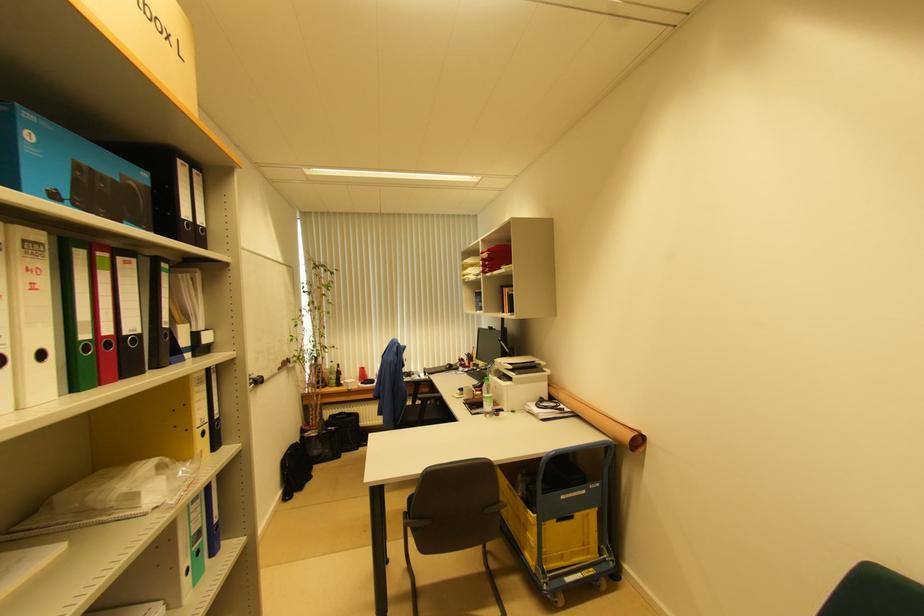
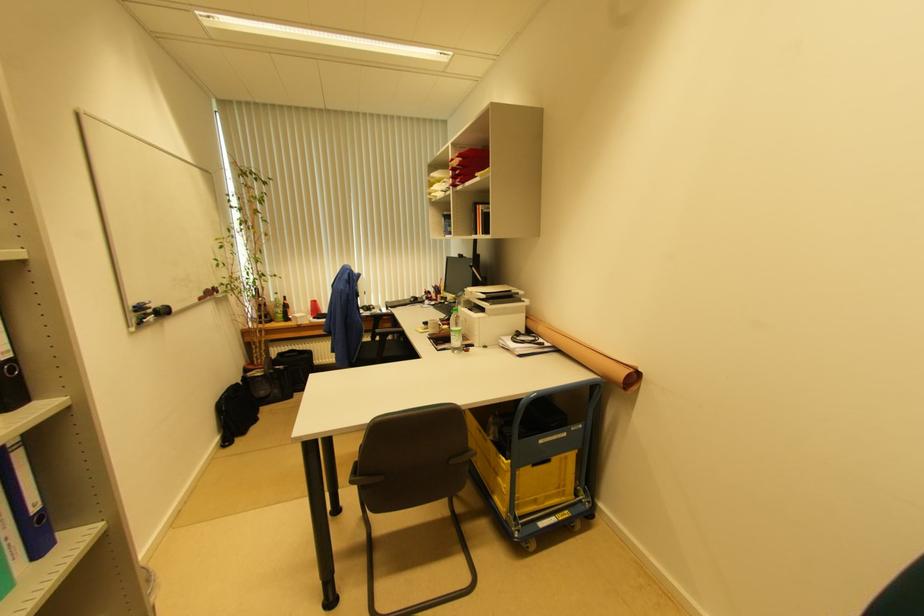
In the second image, find the point that corresponds to (x=528, y=532) in the first image.

(499, 477)